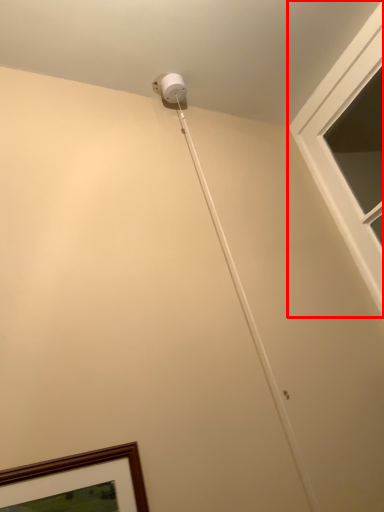
Question: Observing the image, what is the correct spatial positioning of window (annotated by the red box) in reference to string?

Choices:
 (A) left
 (B) right

Answer: (B)